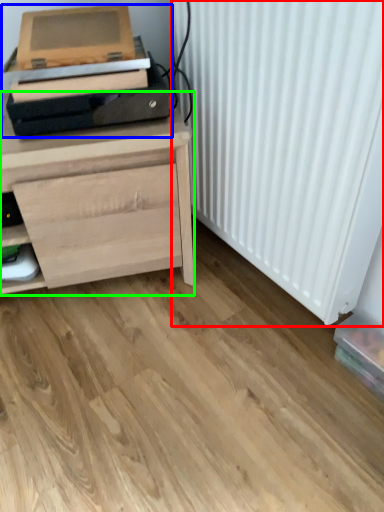
Question: Which is nearer to the radiator (highlighted by a red box)? printer (highlighted by a blue box) or chest of drawers (highlighted by a green box).

Choices:
 (A) printer
 (B) chest of drawers

Answer: (B)